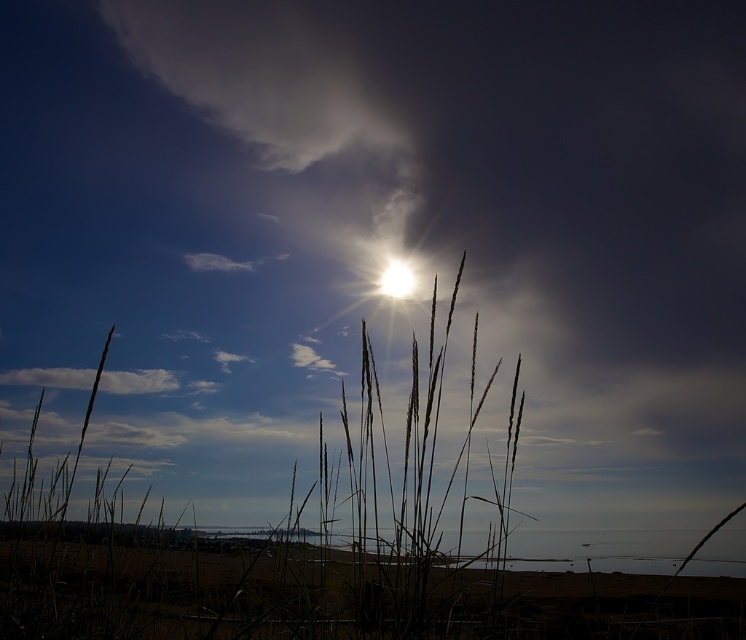
Question: Which point is farther to the camera?

Choices:
 (A) (386, 275)
 (B) (25, 376)

Answer: (B)

Question: Does white fluffy cloud at upper left lie in front of bright white sun at upper center?

Choices:
 (A) no
 (B) yes

Answer: (A)

Question: Is white fluffy cloud at upper left thinner than bright white sun at upper center?

Choices:
 (A) yes
 (B) no

Answer: (B)

Question: Is white fluffy cloud at upper left below bright white sun at upper center?

Choices:
 (A) no
 (B) yes

Answer: (B)

Question: Which object is farther from the camera taking this photo?

Choices:
 (A) bright white sun at upper center
 (B) white fluffy cloud at upper left

Answer: (B)